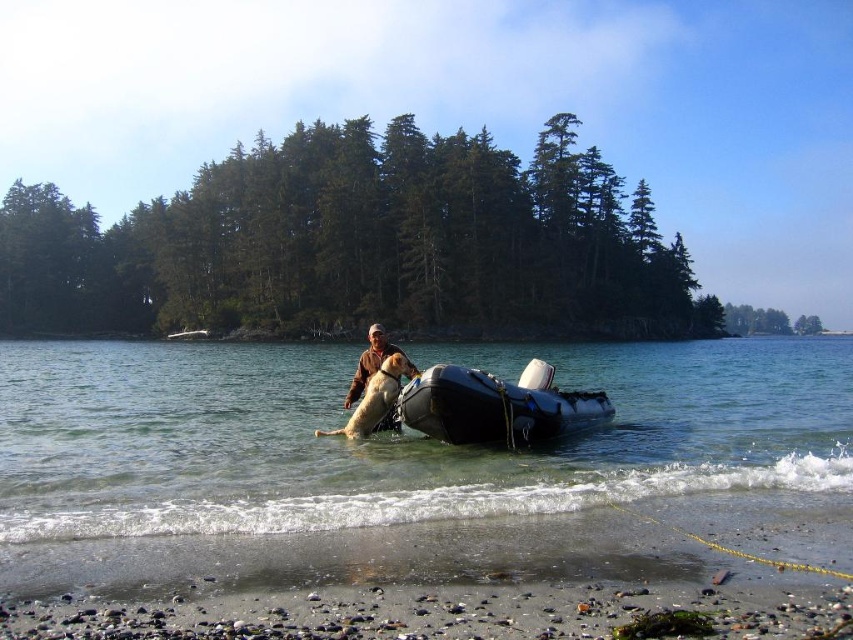
Does clear rubber boat at center appear over brown leather jacket at center?

Incorrect, clear rubber boat at center is not positioned above brown leather jacket at center.

This screenshot has width=853, height=640. What do you see at coordinates (402, 436) in the screenshot? I see `clear rubber boat at center` at bounding box center [402, 436].

You are a GUI agent. You are given a task and a screenshot of the screen. Output one action in this format:
    pyautogui.click(x=<x>, y=<y>)
    Task: Click on the clear rubber boat at center
    
    Given the screenshot: What is the action you would take?
    pyautogui.click(x=402, y=436)

Can you confirm if black rubber boat at center is thinner than brown leather jacket at center?

Incorrect, black rubber boat at center's width is not less than brown leather jacket at center's.

Can you confirm if black rubber boat at center is taller than brown leather jacket at center?

No.

Is point (550, 384) positioned before point (367, 365)?

No.

Locate an element on the screen. The height and width of the screenshot is (640, 853). black rubber boat at center is located at coordinates (497, 404).

Which is more to the left, clear rubber boat at center or black rubber boat at center?

Positioned to the left is black rubber boat at center.

Which of these two, clear rubber boat at center or black rubber boat at center, stands taller?

With more height is black rubber boat at center.

Measure the distance between clear rubber boat at center and camera.

clear rubber boat at center and camera are 9.21 meters apart from each other.

This screenshot has height=640, width=853. What are the coordinates of `clear rubber boat at center` in the screenshot? It's located at (402, 436).